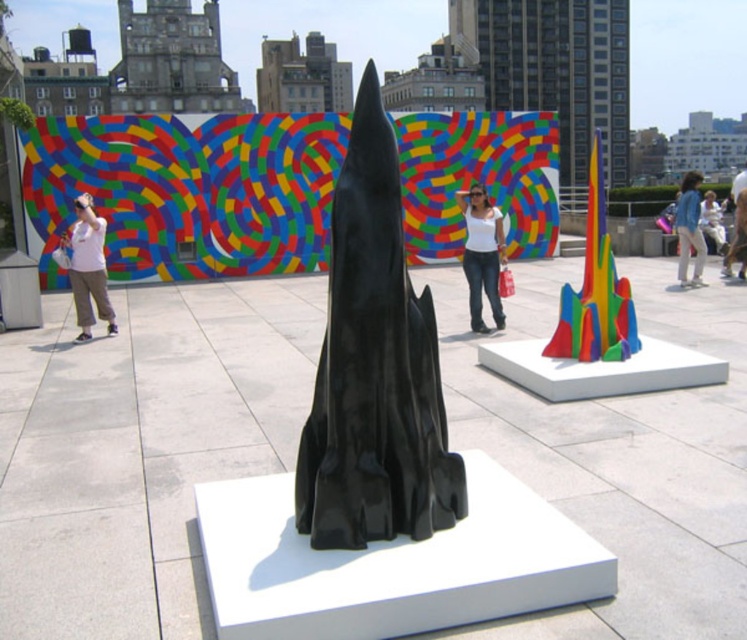
Can you confirm if matte white shirt at left is bigger than blue denim jacket at upper right?

No.

From the picture: Who is shorter, matte white shirt at left or blue denim jacket at upper right?

With less height is matte white shirt at left.

Does point (81, 237) come in front of point (686, 228)?

That is True.

Where is `matte white shirt at left`? The image size is (747, 640). matte white shirt at left is located at coordinates (87, 268).

Who is positioned more to the left, multicolored plastic cone at right or white matte shirt at center?

Positioned to the left is white matte shirt at center.

Is point (562, 317) positioned before point (477, 317)?

Yes, it is in front of point (477, 317).

Which is behind, point (577, 312) or point (480, 323)?

The point (480, 323) is behind.

The image size is (747, 640). Find the location of `multicolored plastic cone at right`. multicolored plastic cone at right is located at coordinates (595, 291).

Based on the photo, is glossy black rocket at center further to camera compared to blue denim jacket at upper right?

That is False.

From the picture: Is glossy black rocket at center in front of blue denim jacket at upper right?

Yes.

Describe the element at coordinates (374, 368) in the screenshot. I see `glossy black rocket at center` at that location.

At what (x,y) coordinates should I click in order to perform the action: click on glossy black rocket at center. Please return your answer as a coordinate pair (x, y). Image resolution: width=747 pixels, height=640 pixels. Looking at the image, I should click on (374, 368).